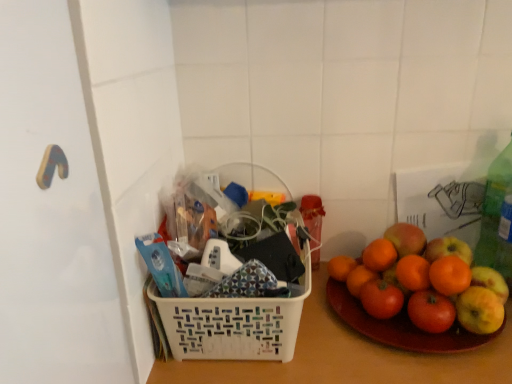
I want to click on white plastic basket at center, so click(x=348, y=356).

Describe the element at coordinates (495, 216) in the screenshot. I see `green plastic bottle at right` at that location.

Where is `smooth orange grapefruit at right`? Image resolution: width=512 pixels, height=384 pixels. smooth orange grapefruit at right is located at coordinates (420, 282).

In the scene shown: From the image's perspective, which one is positioned lower, smooth orange grapefruit at right or green plastic bottle at right?

From the image's view, smooth orange grapefruit at right is below.

From a real-world perspective, is smooth orange grapefruit at right positioned above or below green plastic bottle at right?

In terms of real-world spatial position, smooth orange grapefruit at right is below green plastic bottle at right.

Which is in front, smooth orange grapefruit at right or green plastic bottle at right?

smooth orange grapefruit at right is closer to the camera.

Based on the photo, which of these two, smooth orange grapefruit at right or green plastic bottle at right, is thinner?

green plastic bottle at right.

Which is in front, point (298, 221) or point (420, 319)?

The point (420, 319) is closer to the camera.

In terms of size, does white plastic basket at center appear bigger or smaller than smooth orange grapefruit at right?

In the image, white plastic basket at center appears to be larger than smooth orange grapefruit at right.

From a real-world perspective, is white plastic basket at center above or below smooth orange grapefruit at right?

From a real-world perspective, white plastic basket at center is physically below smooth orange grapefruit at right.

Does white plastic basket at center come in front of smooth orange grapefruit at right?

Yes.

Considering the positions of objects white plastic basket at center and smooth orange grapefruit at right in the image provided, who is more to the right, white plastic basket at center or smooth orange grapefruit at right?

smooth orange grapefruit at right.

Is white plastic basket at center wider or thinner than smooth orange grapefruit at right?

In the image, white plastic basket at center appears to be wider than smooth orange grapefruit at right.

Are smooth orange grapefruit at right and white plastic basket at center making contact?

No, smooth orange grapefruit at right is not in contact with white plastic basket at center.

Consider the image. Considering the relative sizes of smooth orange grapefruit at right and white plastic basket at center in the image provided, is smooth orange grapefruit at right smaller than white plastic basket at center?

Indeed, smooth orange grapefruit at right has a smaller size compared to white plastic basket at center.

Is smooth orange grapefruit at right positioned in front of white plastic basket at center?

No, it is behind white plastic basket at center.

In the scene shown: Is smooth orange grapefruit at right turned away from white plastic basket at center?

That's not correct — smooth orange grapefruit at right is not looking away from white plastic basket at center.

In the image, is white plastic basket at center positioned in front of or behind green plastic bottle at right?

white plastic basket at center is positioned closer to the viewer than green plastic bottle at right.

Considering the sizes of objects white plastic basket at center and green plastic bottle at right in the image provided, who is thinner, white plastic basket at center or green plastic bottle at right?

green plastic bottle at right.

Would you say white plastic basket at center is inside or outside green plastic bottle at right?

white plastic basket at center is located beyond the bounds of green plastic bottle at right.

Does white plastic basket at center have a lesser height compared to green plastic bottle at right?

No.

Is white plastic basket at center located outside green plastic bottle at right?

That's correct, white plastic basket at center is outside of green plastic bottle at right.

Between white plastic basket at center and green plastic bottle at right, which one has more height?

With more height is green plastic bottle at right.

Considering the relative positions of white plastic basket at center and green plastic bottle at right in the image provided, is white plastic basket at center to the left of green plastic bottle at right from the viewer's perspective?

Yes, white plastic basket at center is to the left of green plastic bottle at right.

From a real-world perspective, which is physically below, white plastic basket at center or green plastic bottle at right?

From a 3D spatial view, white plastic basket at center is below.

From their relative heights in the image, would you say white plastic basket at center is taller or shorter than white plastic basket at center?

Clearly, white plastic basket at center is taller compared to white plastic basket at center.

Is white plastic basket at center in contact with white plastic basket at center?

No, white plastic basket at center is not beside white plastic basket at center.

From a real-world perspective, between white plastic basket at center and white plastic basket at center, who is vertically lower?

white plastic basket at center, from a real-world perspective.

Does point (338, 332) come in front of point (170, 333)?

No, it is not.

You are a GUI agent. You are given a task and a screenshot of the screen. Output one action in this format:
    pyautogui.click(x=<x>, y=<y>)
    Task: Click on the bottle lying on the right of smooth orange grapefruit at right
    This screenshot has height=384, width=512.
    Given the screenshot: What is the action you would take?
    pyautogui.click(x=495, y=216)

This screenshot has width=512, height=384. Find the location of `basket in front of the smooth orange grapefruit at right`. basket in front of the smooth orange grapefruit at right is located at coordinates (232, 324).

Based on their spatial positions, is green plastic bottle at right or white plastic basket at center closer to smooth orange grapefruit at right?

Based on the image, white plastic basket at center appears to be nearer to smooth orange grapefruit at right.

Based on their spatial positions, is white plastic basket at center or smooth orange grapefruit at right closer to white plastic basket at center?

Among the two, white plastic basket at center is located nearer to white plastic basket at center.

From the image, which object appears to be nearer to white plastic basket at center, white plastic basket at center or green plastic bottle at right?

white plastic basket at center is positioned closer to the anchor white plastic basket at center.

Based on their spatial positions, is green plastic bottle at right or smooth orange grapefruit at right closer to white plastic basket at center?

smooth orange grapefruit at right is closer to white plastic basket at center.

Consider the image. Based on their spatial positions, is white plastic basket at center or smooth orange grapefruit at right closer to white plastic basket at center?

smooth orange grapefruit at right is closer to white plastic basket at center.

Looking at the image, which one is located further to white plastic basket at center, green plastic bottle at right or white plastic basket at center?

green plastic bottle at right is further to white plastic basket at center.

When comparing their distances from white plastic basket at center, does green plastic bottle at right or white plastic basket at center seem further?

green plastic bottle at right.

Based on the photo, looking at the image, which one is located closer to green plastic bottle at right, white plastic basket at center or smooth orange grapefruit at right?

smooth orange grapefruit at right is closer to green plastic bottle at right.

In order to click on grapefruit between green plastic bottle at right and white plastic basket at center from top to bottom in this screenshot , I will do `click(420, 282)`.

Identify the location of grapefruit located between white plastic basket at center and green plastic bottle at right in the left-right direction. The image size is (512, 384). (420, 282).

Locate an element on the screen. table top between white plastic basket at center and smooth orange grapefruit at right is located at coordinates (348, 356).

Identify the location of table top between white plastic basket at center and green plastic bottle at right in the horizontal direction. (348, 356).